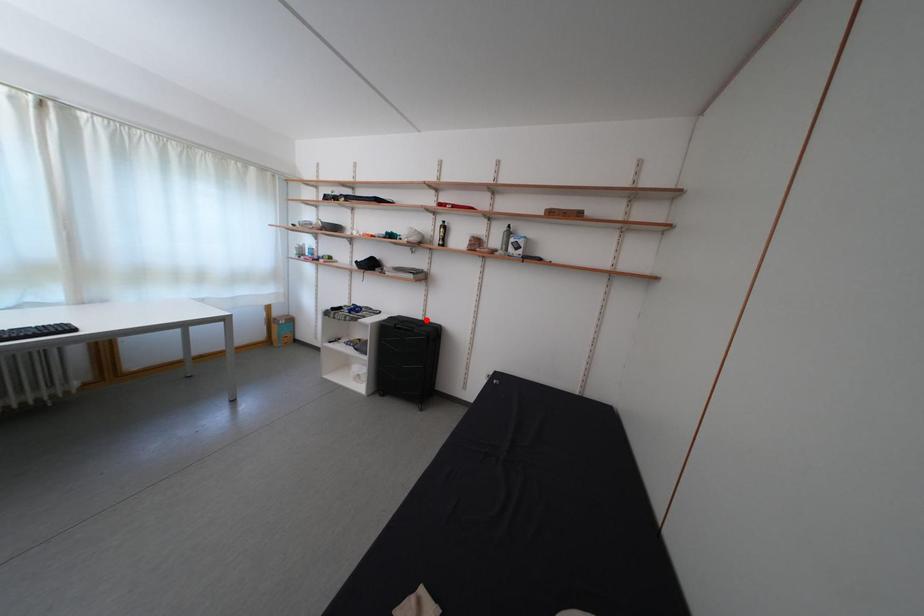
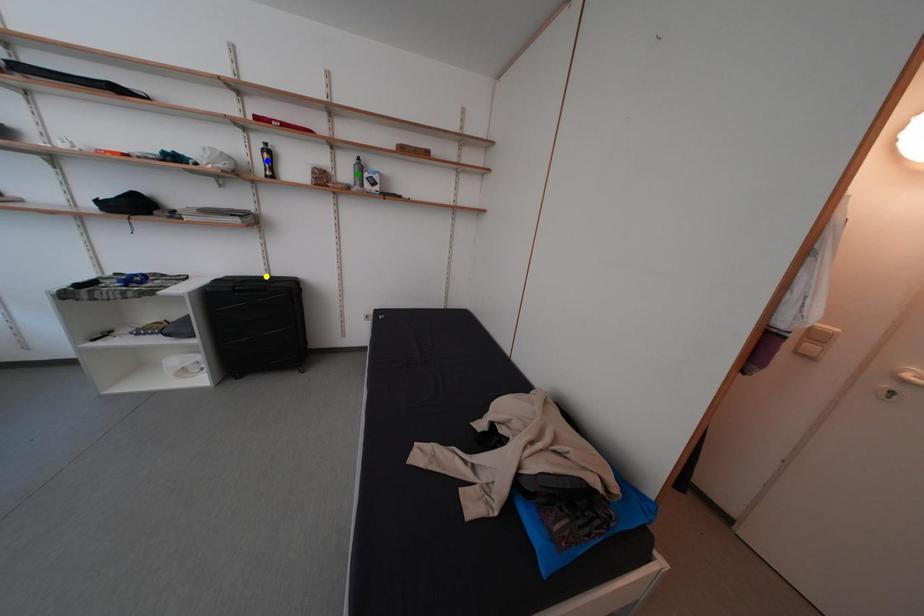
Question: I am providing you with two images of the same scene from different viewpoints. A red point is marked on the first image. You are given multiple points on the second image. Which point in image 2 is actually the same real-world point as the red point in image 1?

Choices:
 (A) green point
 (B) yellow point
 (C) blue point

Answer: (B)